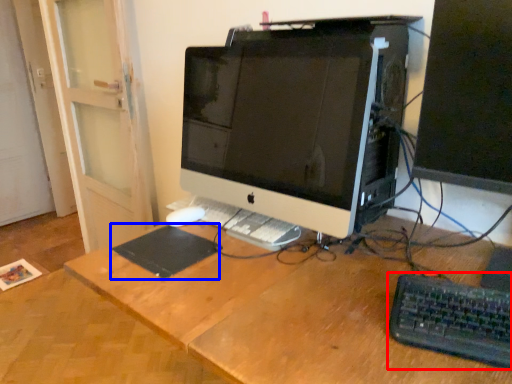
Question: Among these objects, which one is farthest to the camera, computer keyboard (highlighted by a red box) or mousepad (highlighted by a blue box)?

Choices:
 (A) computer keyboard
 (B) mousepad

Answer: (B)